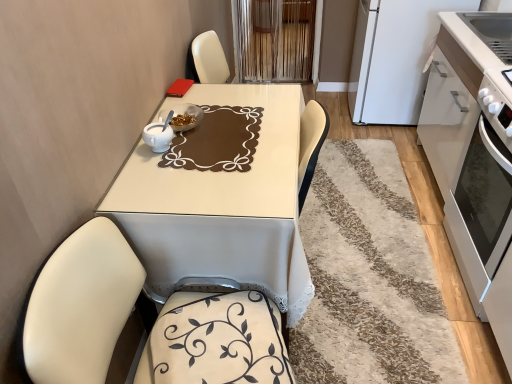
Locate an element on the screen. This screenshot has height=384, width=512. blank space above white glossy table at center (from a real-world perspective) is located at coordinates (222, 155).